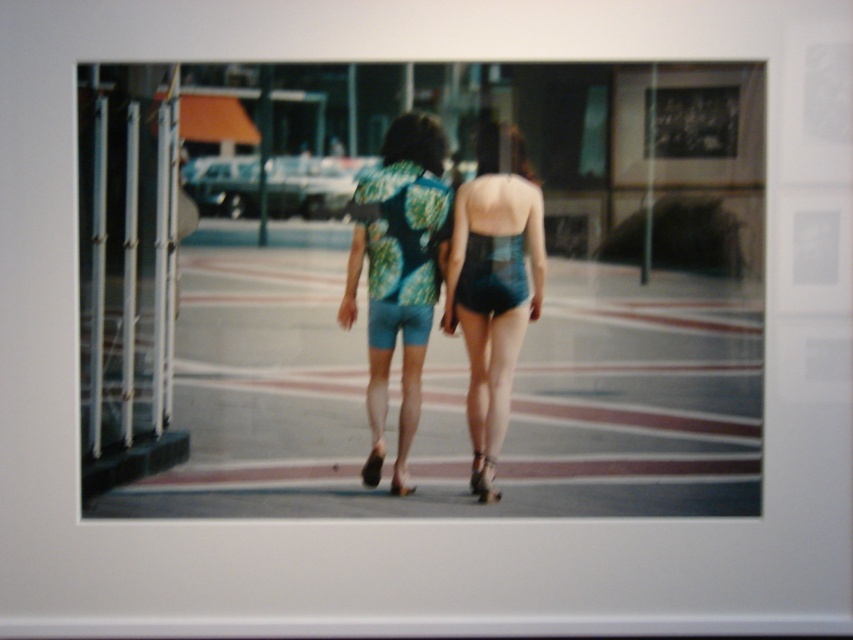
Can you confirm if teal satin shorts at center is smaller than green floral fabric dress at center?

No.

Is teal satin shorts at center further to camera compared to green floral fabric dress at center?

No, teal satin shorts at center is closer to the viewer.

Which is behind, point (419, 224) or point (437, 188)?

The point (419, 224) is more distant.

I want to click on teal satin shorts at center, so click(x=399, y=273).

Does point (376, 381) come farther from viewer compared to point (480, 156)?

Yes, point (376, 381) is farther from viewer.

Who is shorter, teal satin shorts at center or teal fabric shorts at center?

teal fabric shorts at center is shorter.

Locate an element on the screen. The image size is (853, 640). teal satin shorts at center is located at coordinates (399, 273).

Is teal fabric shorts at center bigger than green floral fabric dress at center?

Correct, teal fabric shorts at center is larger in size than green floral fabric dress at center.

Who is lower down, teal fabric shorts at center or green floral fabric dress at center?

teal fabric shorts at center is below.

Image resolution: width=853 pixels, height=640 pixels. Find the location of `teal fabric shorts at center`. teal fabric shorts at center is located at coordinates (492, 285).